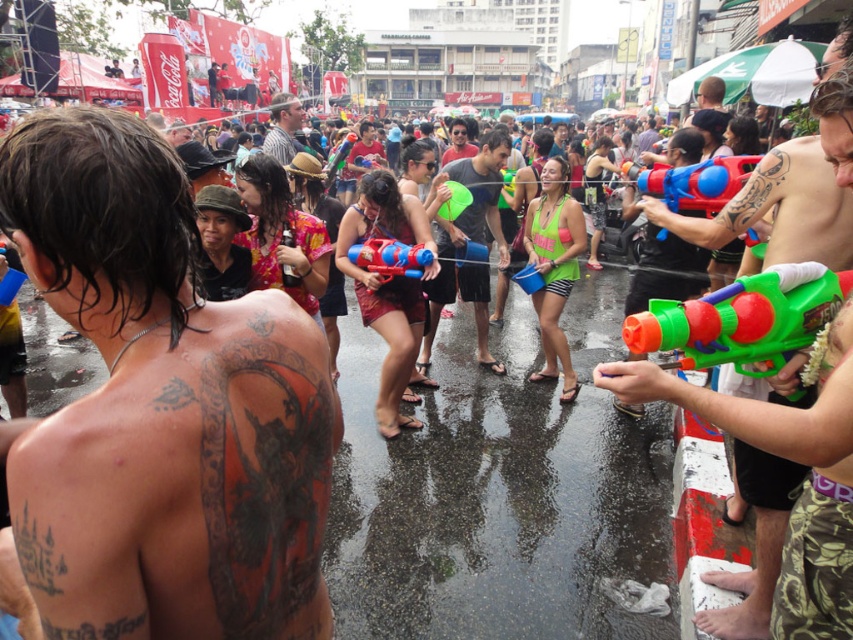
You are standing at point (483, 316) and want to walk to the Coca Cola advertisement banner in the background. Is there a clear path to walk through without going through point (741, 355)?

Point (741, 355) is in front of point (483, 316), so there is an obstruction at point (741, 355) blocking the path to the Coca Cola advertisement banner in the background.